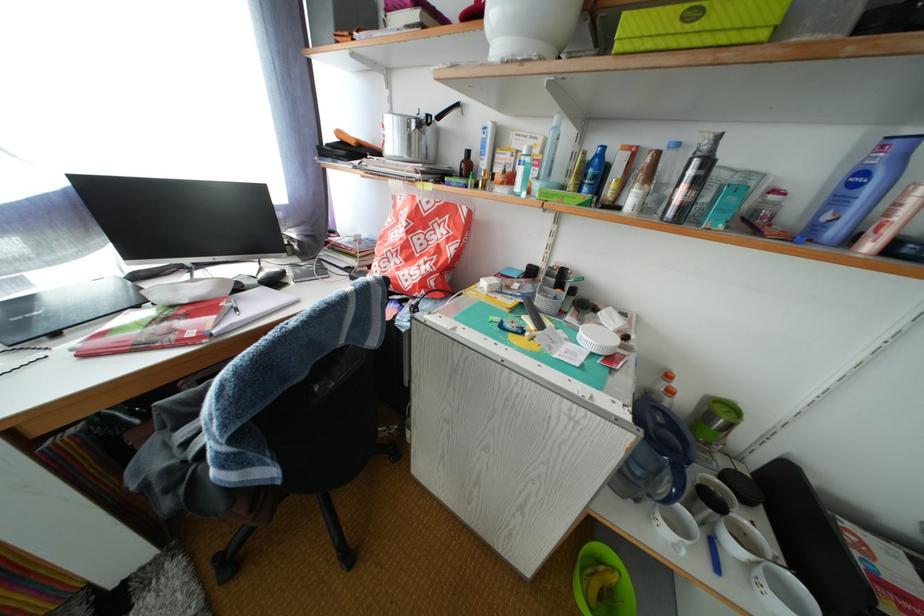
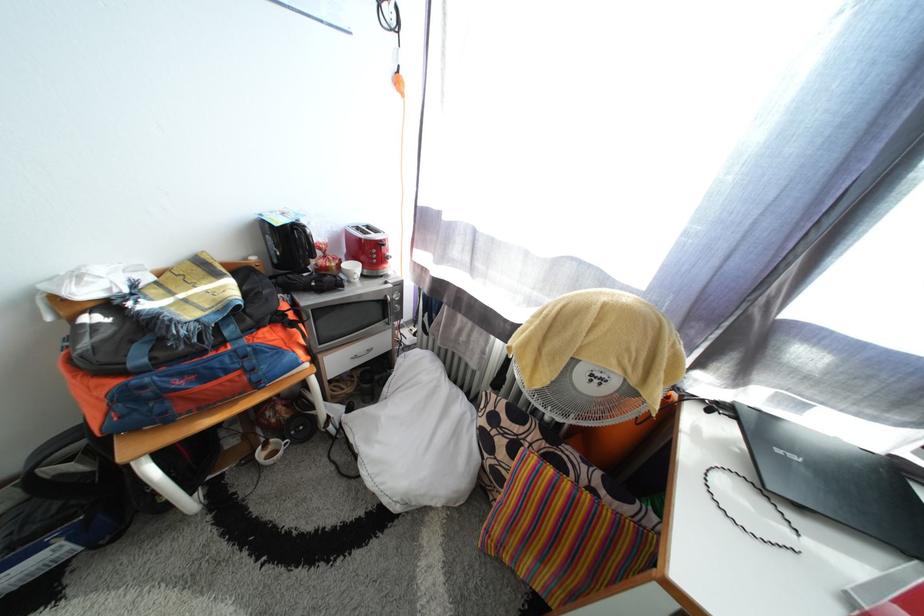
The images are taken continuously from a first-person perspective. In which direction is your viewpoint rotating?

The camera rotated toward left-down.